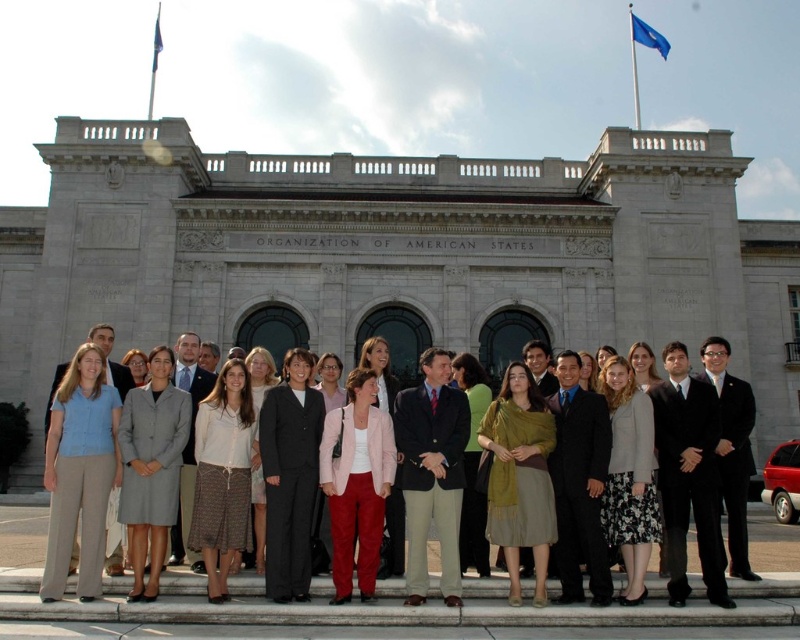
Is light blue shirt at center shorter than blue fabric flag at upper right?

In fact, light blue shirt at center may be taller than blue fabric flag at upper right.

Between point (98, 429) and point (636, 13), which one is positioned behind?

The point (636, 13) is more distant.

Who is more forward, (80, 550) or (641, 40)?

Point (80, 550) is more forward.

Where is `light blue shirt at center`? The image size is (800, 640). light blue shirt at center is located at coordinates (80, 472).

Who is more forward, [442,436] or [156,67]?

Point [442,436]

Who is positioned more to the left, dark blue suit at center or white fabric flag at upper left?

white fabric flag at upper left

Which is behind, point (408, 464) or point (158, 45)?

Point (158, 45)

The width and height of the screenshot is (800, 640). In order to click on dark blue suit at center in this screenshot , I will do `click(432, 472)`.

Does matte black suit at center appear under black suit at center?

Correct, matte black suit at center is located below black suit at center.

Between point (68, 385) and point (658, 420), which one is positioned in front?

Point (68, 385) is in front.

Who is more forward, (150, 477) or (660, 472)?

Point (150, 477) is more forward.

In order to click on matte black suit at center in this screenshot , I will do `click(262, 474)`.